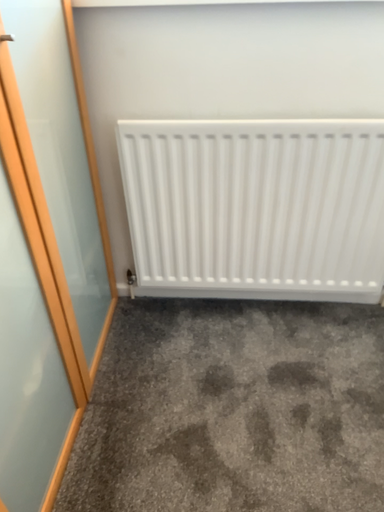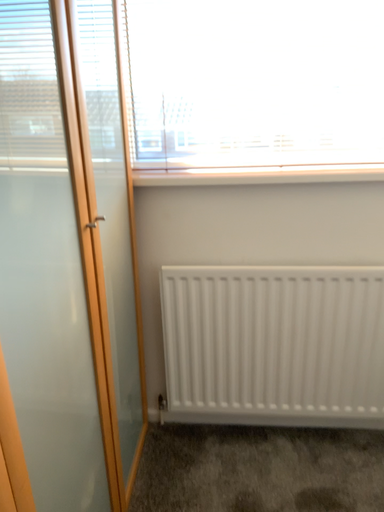
Question: Which way did the camera rotate in the video?

Choices:
 (A) rotated upward
 (B) rotated downward

Answer: (A)